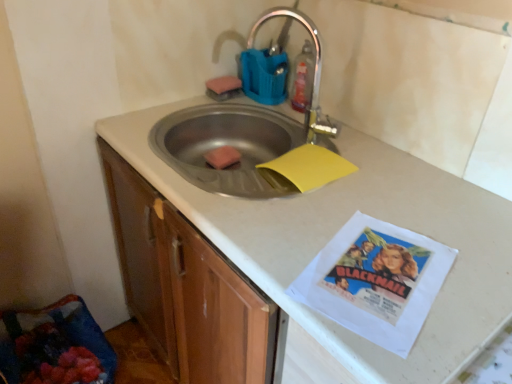
Question: From a real-world perspective, relative to translucent plastic bottle at upper center, is yellow matte paper at sink vertically above or below?

Choices:
 (A) below
 (B) above

Answer: (A)

Question: Considering the positions of yellow matte paper at sink and translucent plastic bottle at upper center in the image, is yellow matte paper at sink wider or thinner than translucent plastic bottle at upper center?

Choices:
 (A) thin
 (B) wide

Answer: (B)

Question: Estimate the real-world distances between objects in this image. Which object is closer to the translucent plastic bottle at upper center?

Choices:
 (A) pink sponge at upper center, placed as the second food when sorted from bottom to top
 (B) pink sponge at sink, the second food when ordered from top to bottom
 (C) white matte countertop at center
 (D) yellow matte paper at sink

Answer: (A)

Question: Which object is the closest to the white matte countertop at center?

Choices:
 (A) pink sponge at sink, the first food ordered from the bottom
 (B) pink sponge at upper center, placed as the second food when sorted from bottom to top
 (C) translucent plastic bottle at upper center
 (D) yellow matte paper at sink

Answer: (D)